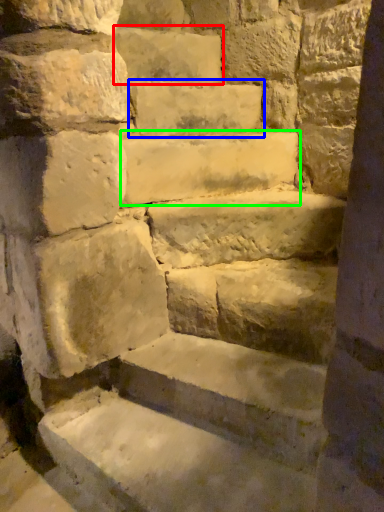
Question: Based on their relative distances, which object is nearer to brick (highlighted by a red box)? Choose from brick (highlighted by a blue box) and stone (highlighted by a green box).

Choices:
 (A) brick
 (B) stone

Answer: (A)